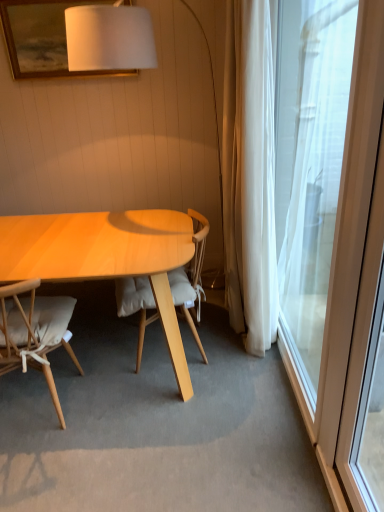
Question: Is transparent glass window at right positioned before light brown wood chair at left, acting as the first chair starting from the left?

Choices:
 (A) yes
 (B) no

Answer: (A)

Question: Is transparent glass window at right further to camera compared to light brown wood chair at left, acting as the first chair starting from the left?

Choices:
 (A) no
 (B) yes

Answer: (A)

Question: Is transparent glass window at right directly adjacent to light brown wood chair at left, which ranks as the second chair in right-to-left order?

Choices:
 (A) no
 (B) yes

Answer: (A)

Question: Would you say transparent glass window at right is a long distance from light brown wood chair at left, which ranks as the second chair in right-to-left order?

Choices:
 (A) yes
 (B) no

Answer: (A)

Question: Is light brown wood chair at left, acting as the first chair starting from the left, completely or partially inside transparent glass window at right?

Choices:
 (A) yes
 (B) no

Answer: (B)

Question: Is light wood/wooden chair at center, the 1th chair viewed from the right, taller or shorter than light brown wood chair at left, acting as the first chair starting from the left?

Choices:
 (A) tall
 (B) short

Answer: (A)

Question: From the image's perspective, is light wood/wooden chair at center, the 2th chair in the left-to-right sequence, above or below light brown wood chair at left, acting as the first chair starting from the left?

Choices:
 (A) above
 (B) below

Answer: (A)

Question: Does point (140, 307) appear closer or farther from the camera than point (33, 330)?

Choices:
 (A) closer
 (B) farther

Answer: (B)

Question: Is light wood/wooden chair at center, the 2th chair in the left-to-right sequence, bigger or smaller than light brown wood chair at left, acting as the first chair starting from the left?

Choices:
 (A) big
 (B) small

Answer: (A)

Question: Which is correct: white matte picture frame at upper center is inside light brown wood chair at left, which ranks as the second chair in right-to-left order, or outside of it?

Choices:
 (A) inside
 (B) outside

Answer: (B)

Question: Is white matte picture frame at upper center taller or shorter than light brown wood chair at left, acting as the first chair starting from the left?

Choices:
 (A) tall
 (B) short

Answer: (B)

Question: From the image's perspective, is white matte picture frame at upper center located above or below light brown wood chair at left, acting as the first chair starting from the left?

Choices:
 (A) above
 (B) below

Answer: (A)

Question: From a real-world perspective, is white matte picture frame at upper center positioned above or below light brown wood chair at left, which ranks as the second chair in right-to-left order?

Choices:
 (A) above
 (B) below

Answer: (A)

Question: From the image's perspective, relative to light brown wood chair at left, acting as the first chair starting from the left, is transparent glass window at right above or below?

Choices:
 (A) below
 (B) above

Answer: (B)

Question: Is point (349, 13) closer or farther from the camera than point (13, 287)?

Choices:
 (A) closer
 (B) farther

Answer: (B)